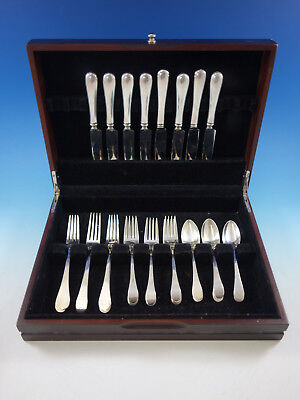
This screenshot has height=400, width=300. I want to click on handles, so point(92,82), point(107,84), point(129,80), point(144,88), point(165,83), point(183,84), point(201,83), point(214,85).